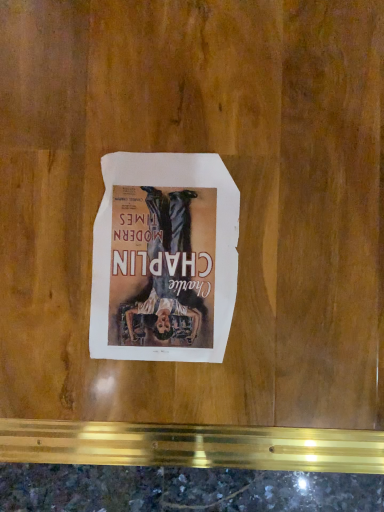
Image resolution: width=384 pixels, height=512 pixels. What are the coordinates of `blank space situated above white paper poster at center (from a real-world perspective)` in the screenshot? It's located at (158, 257).